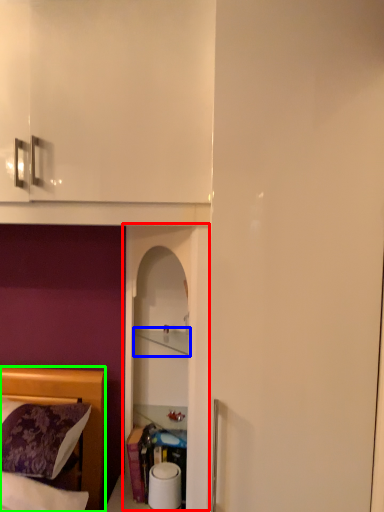
Question: Which object is positioned farthest from glass door (highlighted by a red box)? Select from cabinet (highlighted by a blue box) and bed (highlighted by a green box).

Choices:
 (A) cabinet
 (B) bed

Answer: (B)